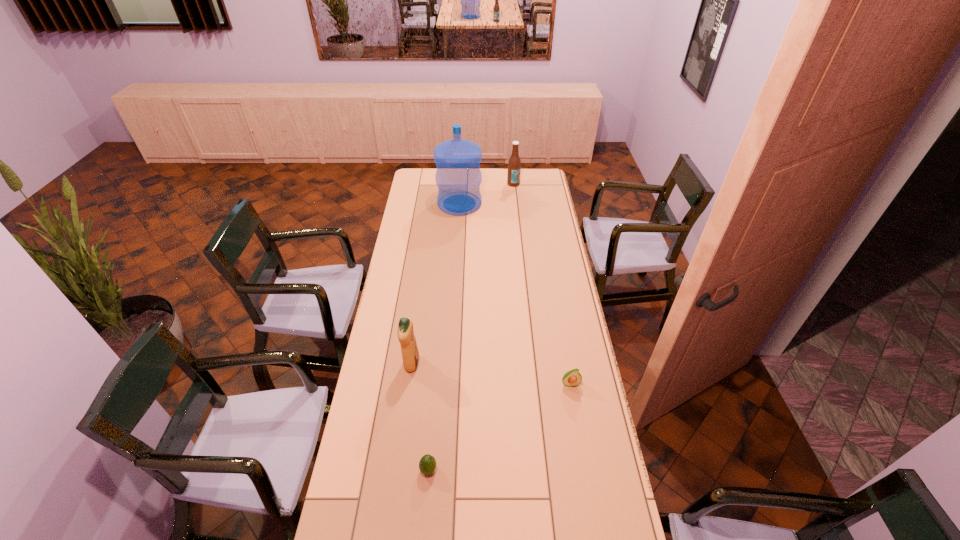
You are a GUI agent. You are given a task and a screenshot of the screen. Output one action in this format:
    pyautogui.click(x=<x>, y=<y>)
    Task: Click on the second farthest object
    Image resolution: width=960 pixels, height=540 pixels.
    Given the screenshot: What is the action you would take?
    pyautogui.click(x=458, y=177)

What are the coordinates of `water jug` in the screenshot? It's located at (458, 177).

Find the location of a particular element. This screenshot has width=960, height=540. beer bottle is located at coordinates (514, 164).

Where is `the second object from right to left`? The height and width of the screenshot is (540, 960). the second object from right to left is located at coordinates (514, 164).

Where is `detergent`? This screenshot has width=960, height=540. detergent is located at coordinates (410, 355).

Image resolution: width=960 pixels, height=540 pixels. In order to click on the right avocado in this screenshot , I will do `click(572, 378)`.

This screenshot has width=960, height=540. Identify the location of the fourth farthest object. (572, 378).

This screenshot has width=960, height=540. In order to click on the nearer avocado in this screenshot , I will do point(427,464).

You are a GUI agent. You are given a task and a screenshot of the screen. Output one action in this format:
    pyautogui.click(x=<x>, y=<y>)
    Task: Click on the nearest object
    This screenshot has height=540, width=960.
    Given the screenshot: What is the action you would take?
    pyautogui.click(x=427, y=464)

Where is `vacant space situated on the front of the second farthest object`? This screenshot has width=960, height=540. vacant space situated on the front of the second farthest object is located at coordinates (457, 249).